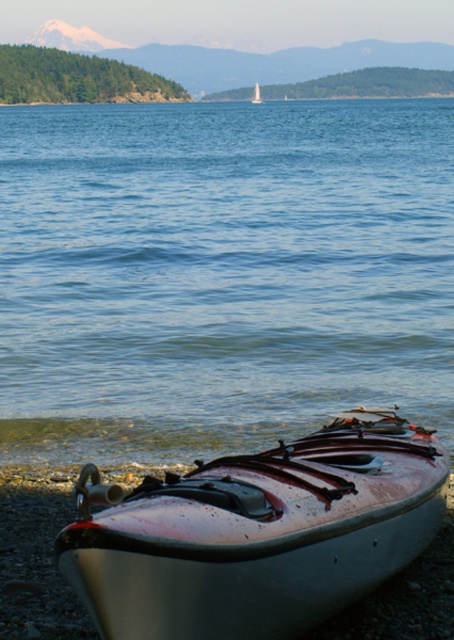
Is blue water at lower center bigger than silver metallic kayak at lower center?

Yes, blue water at lower center is bigger than silver metallic kayak at lower center.

Locate an element on the screen. blue water at lower center is located at coordinates (221, 273).

Does silver metallic kayak at lower center appear under white glossy kayak at lower center?

Indeed, silver metallic kayak at lower center is positioned under white glossy kayak at lower center.

Where is `silver metallic kayak at lower center`? silver metallic kayak at lower center is located at coordinates (257, 532).

This screenshot has height=640, width=454. I want to click on silver metallic kayak at lower center, so pos(257,532).

Which is more to the left, blue water at lower center or white glossy kayak at lower center?

Positioned to the left is blue water at lower center.

Which is behind, point (248, 264) or point (261, 100)?

The point (261, 100) is more distant.

Where is `blue water at lower center`? The image size is (454, 640). blue water at lower center is located at coordinates (221, 273).